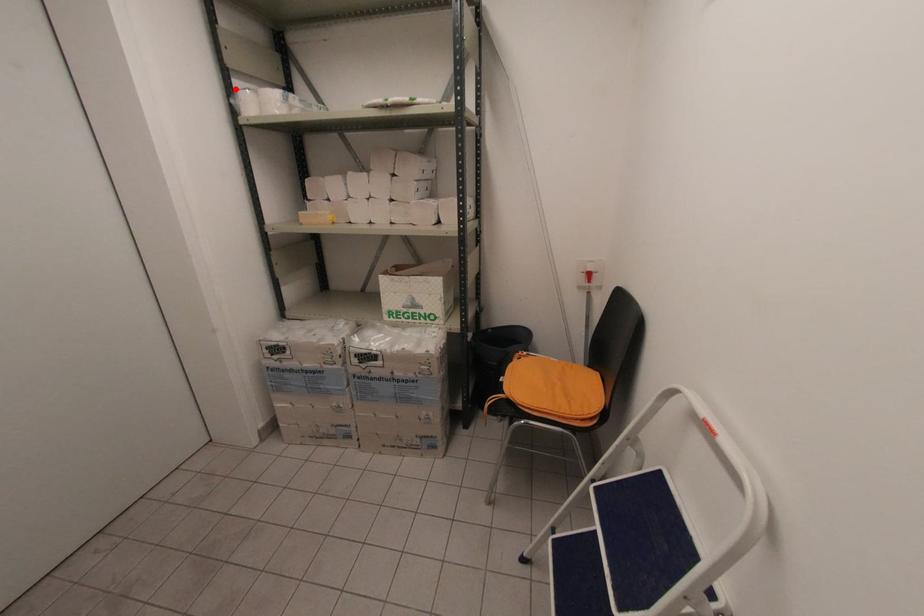
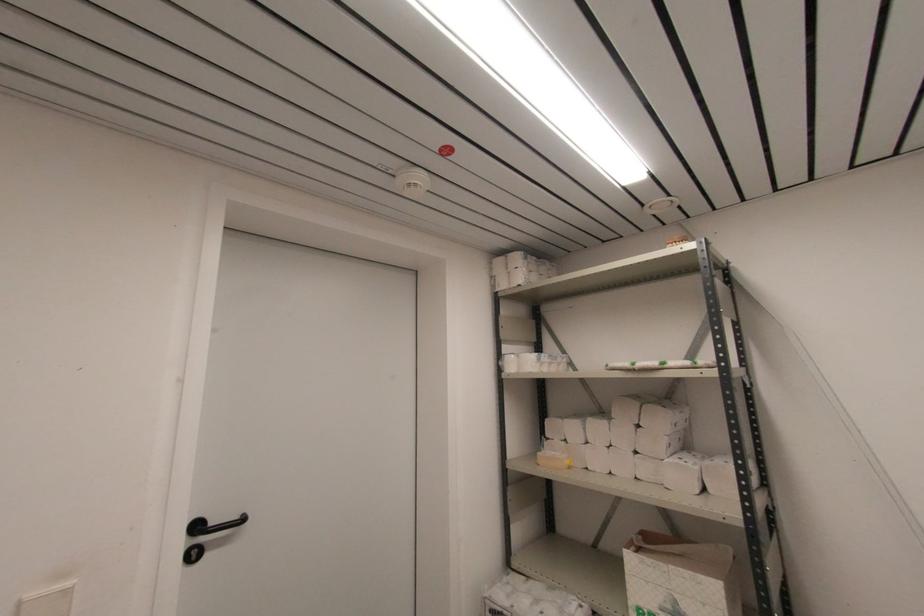
The point at the highlighted location is marked in the first image. Where is the corresponding point in the second image?

(504, 354)